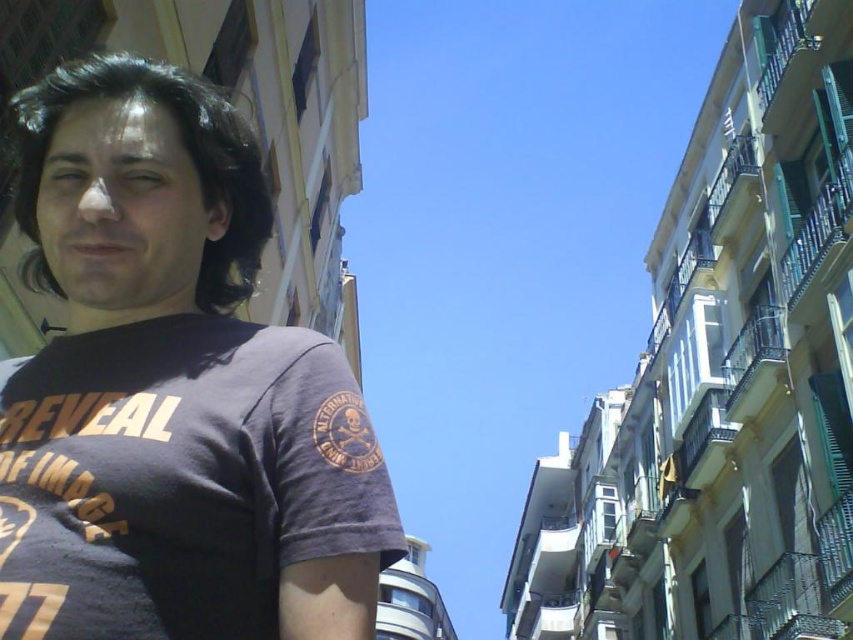
Question: Which of the following is the closest to the observer?

Choices:
 (A) dark purple t-shirt at center
 (B) dark brown hair at center

Answer: (A)

Question: Is dark purple t-shirt at center further to the viewer compared to dark brown hair at center?

Choices:
 (A) yes
 (B) no

Answer: (B)

Question: Is dark purple t-shirt at center thinner than dark brown hair at center?

Choices:
 (A) yes
 (B) no

Answer: (B)

Question: Is dark purple t-shirt at center positioned at the back of dark brown hair at center?

Choices:
 (A) yes
 (B) no

Answer: (B)

Question: Among these points, which one is nearest to the camera?

Choices:
 (A) (241, 220)
 (B) (32, 250)

Answer: (A)